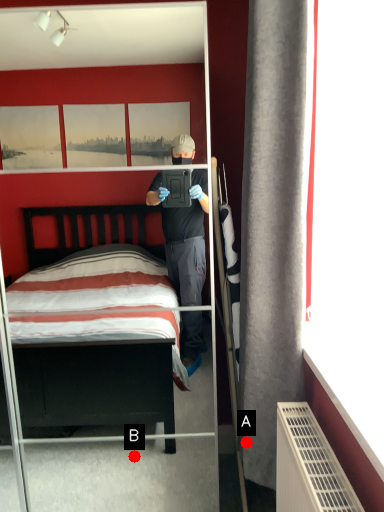
Question: Two points are circled on the image, labeled by A and B beside each circle. Among these points, which one is farthest from the camera?

Choices:
 (A) A is further
 (B) B is further

Answer: (B)